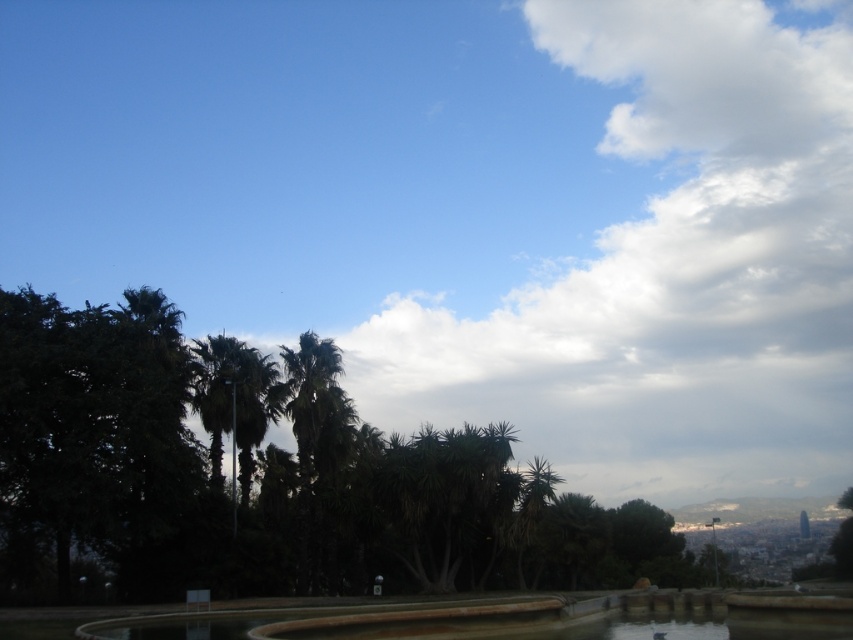
You are standing at the edge of the brown stone fountain at lower center and want to take a photo of the green leafy palm tree at left. Since the fountain is shorter than the palm tree, will you need to tilt your camera upwards to frame the palm tree properly?

Yes, because the brown stone fountain at lower center is shorter than the green leafy palm tree at left, you will need to tilt your camera upwards to frame the palm tree properly.

You are standing at the base of the green leafy palm tree at left and want to walk to the brown stone fountain at lower center. Which direction should you head to reach it?

The brown stone fountain at lower center is located below the green leafy palm tree at left, so you should head downward to reach it.